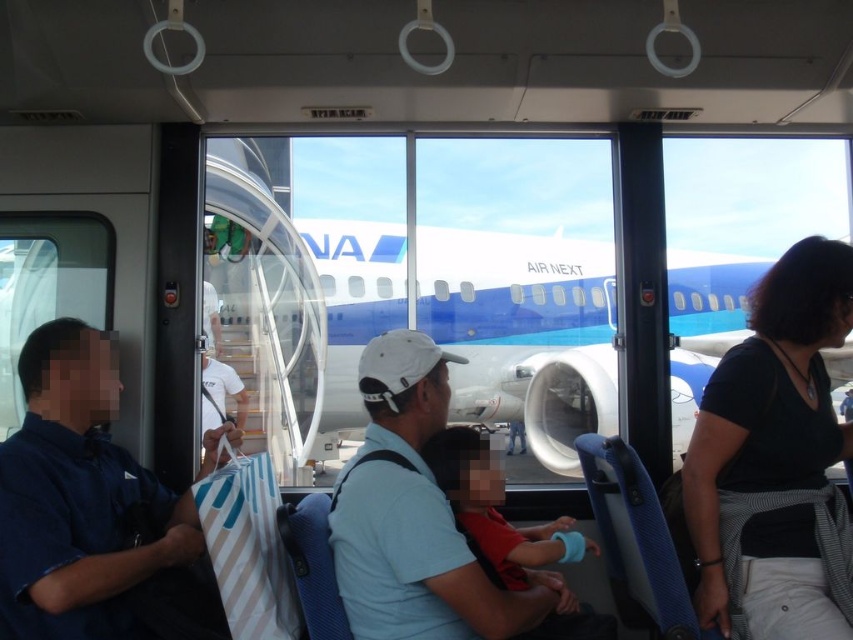
You are inside the bus and want to know which of the two points, point (x=762, y=285) or point (x=126, y=500), is closer to you. Based on the scene, can you determine which point is nearer?

Point (x=762, y=285) is further to the viewer than point (x=126, y=500), so the closer point to you is point (x=126, y=500).

You are a clothing designer observing the scene inside the bus. You need to determine which item is narrower between the black fabric shirt at right and the blue fabric bag at left. Which one is narrower?

The black fabric shirt at right is narrower than the blue fabric bag at left since its width is less than the bag.

You are a passenger on the bus and need to hand over a document to someone sitting across from you. The document is currently in the blue fabric bag at left. If you want to pass it to the person wearing the black fabric shirt at right, will you be able to reach them without leaving your seat?

The black fabric shirt at right is 5.19 feet away from the blue fabric bag at left. Since the distance is over 5 feet, you might need to ask someone to help pass the document as reaching across 5.19 feet without leaving your seat could be difficult.